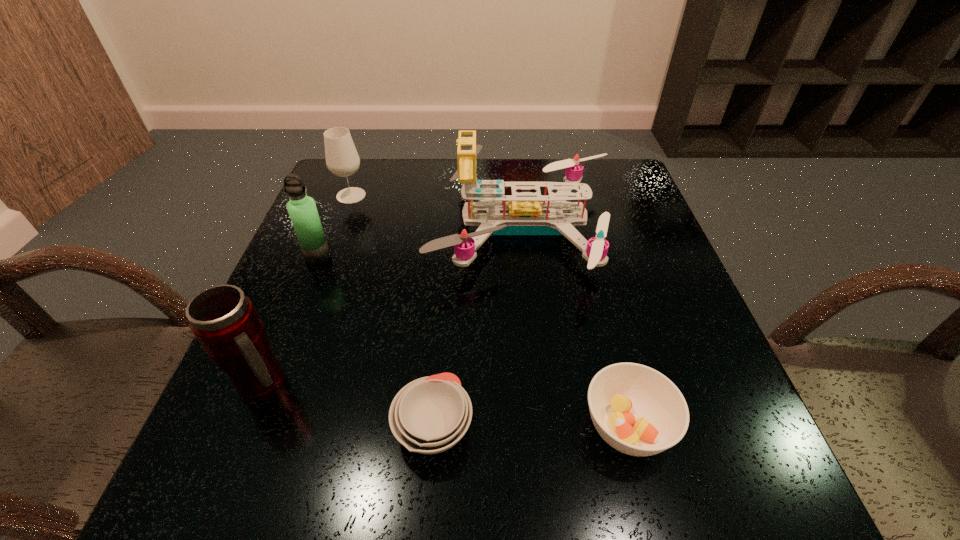
The width and height of the screenshot is (960, 540). I want to click on vacant area that satisfies the following two spatial constraints: 1. on the side with the handle of the right soup bowl; 2. on the left side of the nearer thermos bottle, so click(247, 427).

Locate an element on the screen. The height and width of the screenshot is (540, 960). free space that satisfies the following two spatial constraints: 1. on the side with the handle of the nearer thermos bottle; 2. on the left side of the right soup bowl is located at coordinates (247, 427).

Locate an element on the screen. The width and height of the screenshot is (960, 540). vacant space that satisfies the following two spatial constraints: 1. on the front-facing side of the drone; 2. on the front side of the left soup bowl is located at coordinates (546, 427).

This screenshot has height=540, width=960. In order to click on vacant space that satisfies the following two spatial constraints: 1. on the front side of the farther thermos bottle; 2. on the side with the handle of the nearer thermos bottle in this screenshot , I will do `click(267, 384)`.

This screenshot has height=540, width=960. In order to click on vacant space that satisfies the following two spatial constraints: 1. on the side with the handle of the right soup bowl; 2. on the right side of the nearer thermos bottle in this screenshot , I will do `click(247, 427)`.

Where is `blank area in the image that satisfies the following two spatial constraints: 1. on the front side of the glass; 2. on the left side of the right soup bowl`? The image size is (960, 540). blank area in the image that satisfies the following two spatial constraints: 1. on the front side of the glass; 2. on the left side of the right soup bowl is located at coordinates click(x=265, y=427).